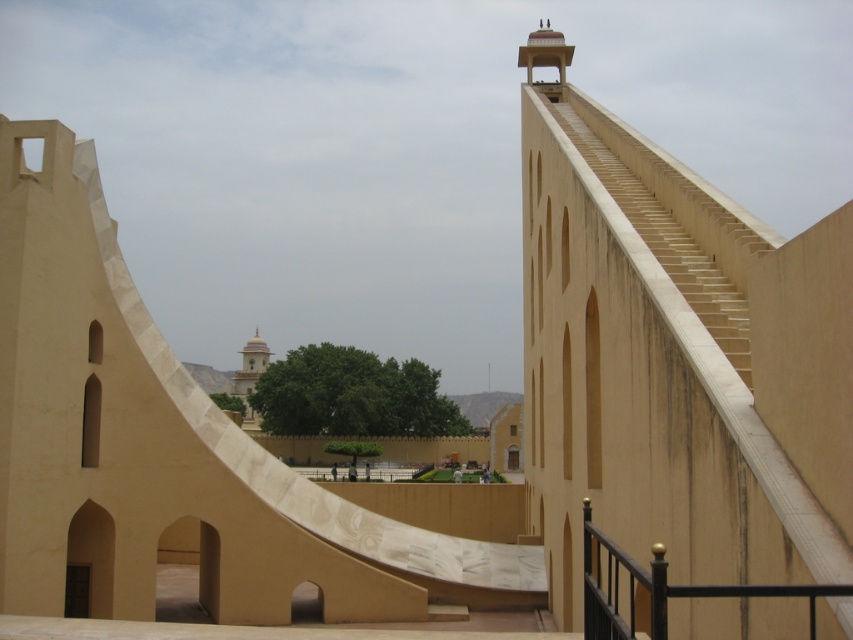
Is black metal railing at lower right behind smooth cream-colored dome at center?

No, black metal railing at lower right is in front of smooth cream-colored dome at center.

Which of these two, black metal railing at lower right or smooth cream-colored dome at center, stands taller?

smooth cream-colored dome at center

Where is `black metal railing at lower right`? black metal railing at lower right is located at coordinates (660, 588).

Between point (612, 182) and point (728, 584), which one is positioned in front?

Point (728, 584) is more forward.

You are a GUI agent. You are given a task and a screenshot of the screen. Output one action in this format:
    pyautogui.click(x=<x>, y=<y>)
    Task: Click on the beige stone staircase at upper center
    
    Given the screenshot: What is the action you would take?
    pyautogui.click(x=666, y=243)

Locate an element on the screen. Image resolution: width=853 pixels, height=640 pixels. beige stone staircase at upper center is located at coordinates click(x=666, y=243).

Is the position of beige stone staircase at upper center less distant than that of smooth cream-colored dome at center?

Yes, it is in front of smooth cream-colored dome at center.

Describe the element at coordinates (666, 243) in the screenshot. I see `beige stone staircase at upper center` at that location.

What do you see at coordinates (666, 243) in the screenshot?
I see `beige stone staircase at upper center` at bounding box center [666, 243].

At what (x,y) coordinates should I click in order to perform the action: click on beige stone staircase at upper center. Please return your answer as a coordinate pair (x, y). Image resolution: width=853 pixels, height=640 pixels. Looking at the image, I should click on (666, 243).